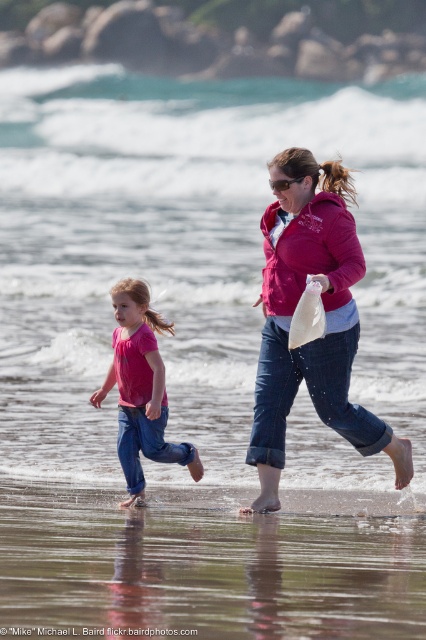
You are standing at the shoreline and want to walk towards the matte pink hoodie at center without getting your feet wet. Which direction should you move relative to the clear water at lower center?

You should move away from the clear water at lower center because it is closer to you than the matte pink hoodie at center, so stepping away from the water will keep your feet dry while approaching the hoodie.

You are a photographer standing at the shoreline and want to take a photo of both the matte pink hoodie at center and the pink matte shirt at center. The minimum distance your camera can focus on two objects simultaneously is 1.5 meters. Can you capture both in focus without adjusting your position?

The matte pink hoodie at center is 1.74 meters away from the pink matte shirt at center. Since the minimum focus distance is 1.5 meters, the camera can capture both in focus as the distance between them is greater than the required minimum.